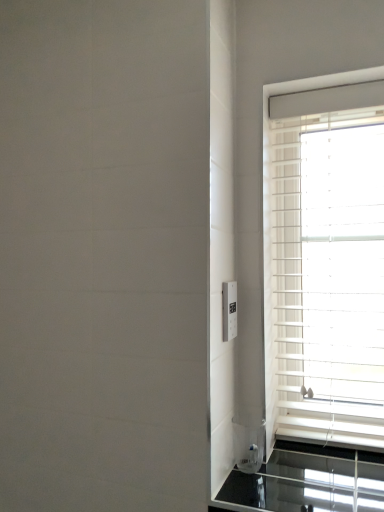
Question: From the image's perspective, does white plastic blinds at right appear lower than white plastic electric outlet at right?

Choices:
 (A) yes
 (B) no

Answer: (B)

Question: Is white plastic blinds at right positioned before white plastic electric outlet at right?

Choices:
 (A) no
 (B) yes

Answer: (A)

Question: Are white plastic blinds at right and white plastic electric outlet at right beside each other?

Choices:
 (A) no
 (B) yes

Answer: (A)

Question: Is white plastic blinds at right not close to white plastic electric outlet at right?

Choices:
 (A) no
 (B) yes

Answer: (A)

Question: Does white plastic blinds at right have a lesser width compared to white plastic electric outlet at right?

Choices:
 (A) yes
 (B) no

Answer: (B)

Question: Could you tell me if white plastic blinds at right is facing white plastic electric outlet at right?

Choices:
 (A) no
 (B) yes

Answer: (A)

Question: Considering the relative sizes of white plastic electric outlet at right and white plastic blinds at right in the image provided, is white plastic electric outlet at right smaller than white plastic blinds at right?

Choices:
 (A) yes
 (B) no

Answer: (A)

Question: Is white plastic electric outlet at right to the left of white plastic blinds at right from the viewer's perspective?

Choices:
 (A) no
 (B) yes

Answer: (B)

Question: From the image's perspective, is white plastic electric outlet at right beneath white plastic blinds at right?

Choices:
 (A) no
 (B) yes

Answer: (B)

Question: Is white plastic electric outlet at right with white plastic blinds at right?

Choices:
 (A) no
 (B) yes

Answer: (A)

Question: Can you confirm if white plastic electric outlet at right is shorter than white plastic blinds at right?

Choices:
 (A) no
 (B) yes

Answer: (B)

Question: Does white plastic electric outlet at right come in front of white plastic blinds at right?

Choices:
 (A) no
 (B) yes

Answer: (B)

Question: Is white plastic blinds at right to the left or to the right of white plastic electric outlet at right in the image?

Choices:
 (A) right
 (B) left

Answer: (A)